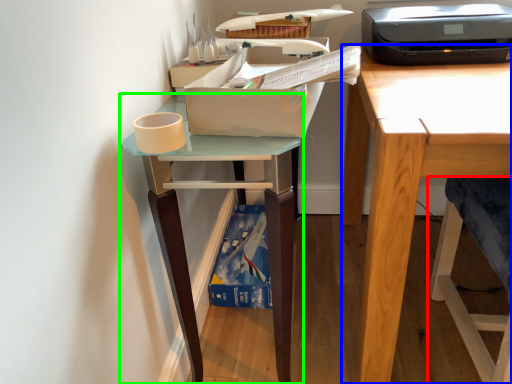
Question: Based on their relative distances, which object is nearer to folding chair (highlighted by a red box)? Choose from desk (highlighted by a blue box) and table (highlighted by a green box).

Choices:
 (A) desk
 (B) table

Answer: (A)